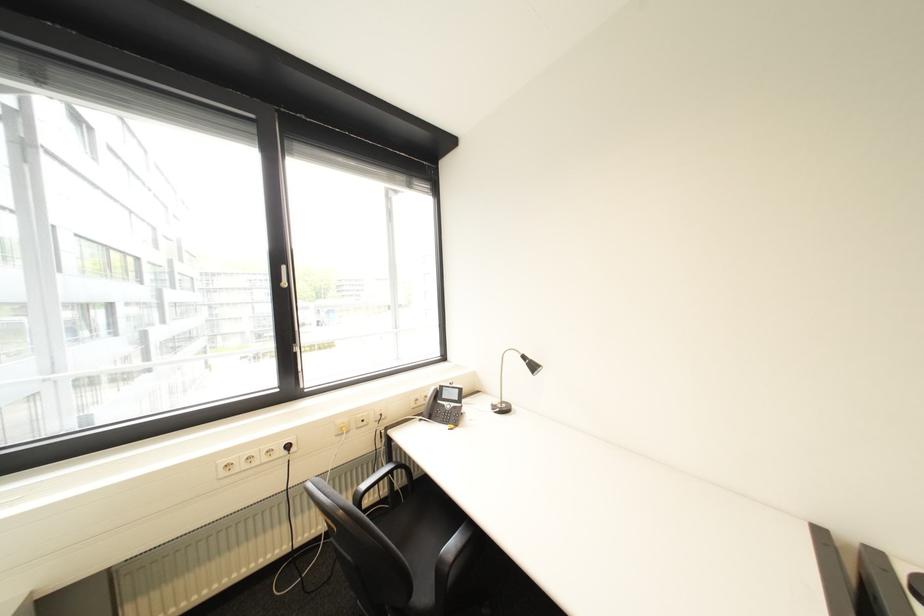
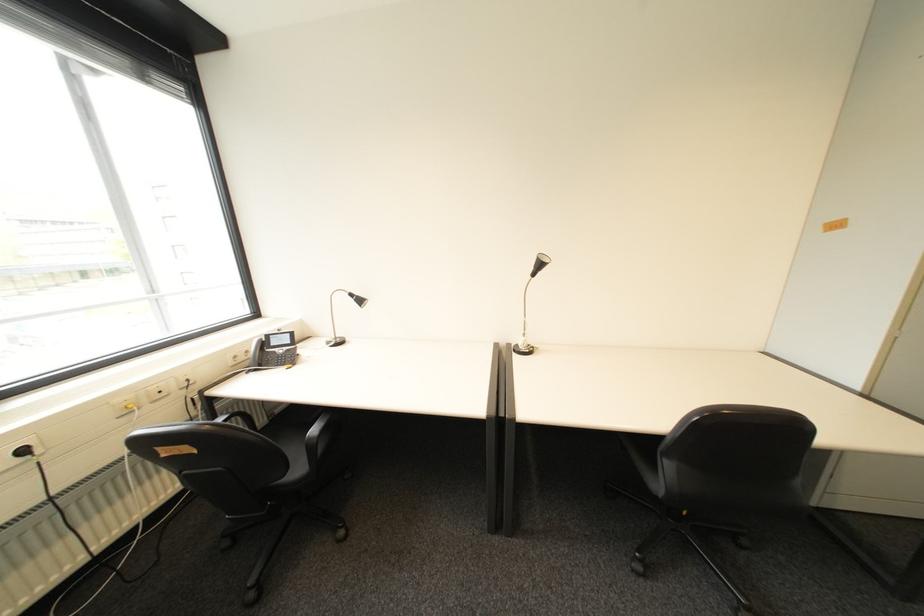
Find the pixel in the second image that matches the point at 298,447 in the first image.

(34, 452)